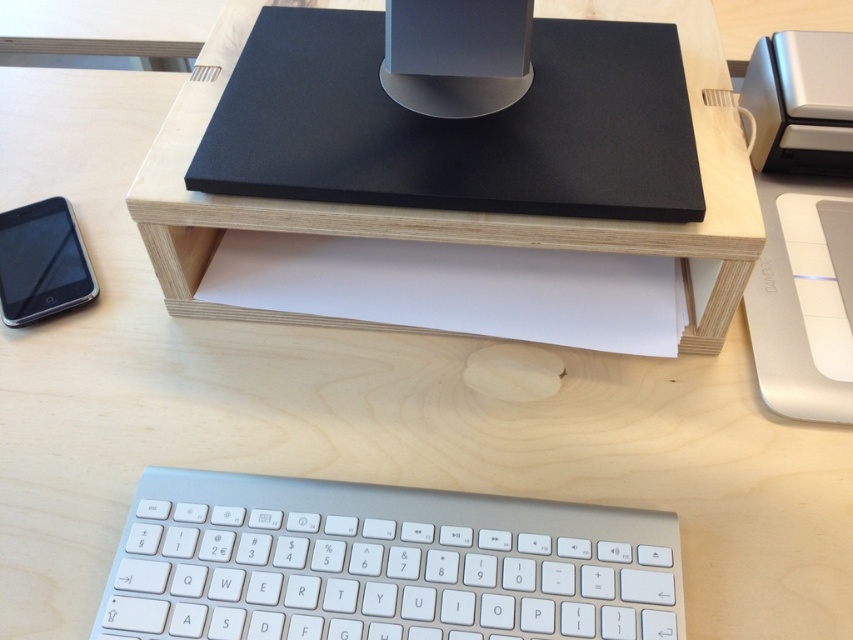
Can you confirm if white plastic keyboard at center is positioned to the left of matte black smartphone at lower left?

In fact, white plastic keyboard at center is to the right of matte black smartphone at lower left.

Where is `white plastic keyboard at center`? white plastic keyboard at center is located at coordinates (381, 564).

Is point (531, 600) farther from viewer compared to point (41, 257)?

No, it is in front of (41, 257).

This screenshot has width=853, height=640. I want to click on white plastic keyboard at center, so click(x=381, y=564).

Does white plastic keyboard at center have a larger size compared to matte black speaker at center?

Yes.

Consider the image. Is white plastic keyboard at center below matte black speaker at center?

Yes, white plastic keyboard at center is below matte black speaker at center.

Is point (166, 593) closer to viewer compared to point (402, 106)?

Yes, point (166, 593) is closer to viewer.

Find the location of a particular element. The width and height of the screenshot is (853, 640). white plastic keyboard at center is located at coordinates (381, 564).

Is matte black speaker at center to the left of matte black smartphone at lower left from the viewer's perspective?

Incorrect, matte black speaker at center is not on the left side of matte black smartphone at lower left.

Is matte black speaker at center wider than matte black smartphone at lower left?

Yes, matte black speaker at center is wider than matte black smartphone at lower left.

Between point (518, 81) and point (9, 224), which one is positioned in front?

Point (518, 81) is more forward.

I want to click on matte black speaker at center, so click(x=456, y=54).